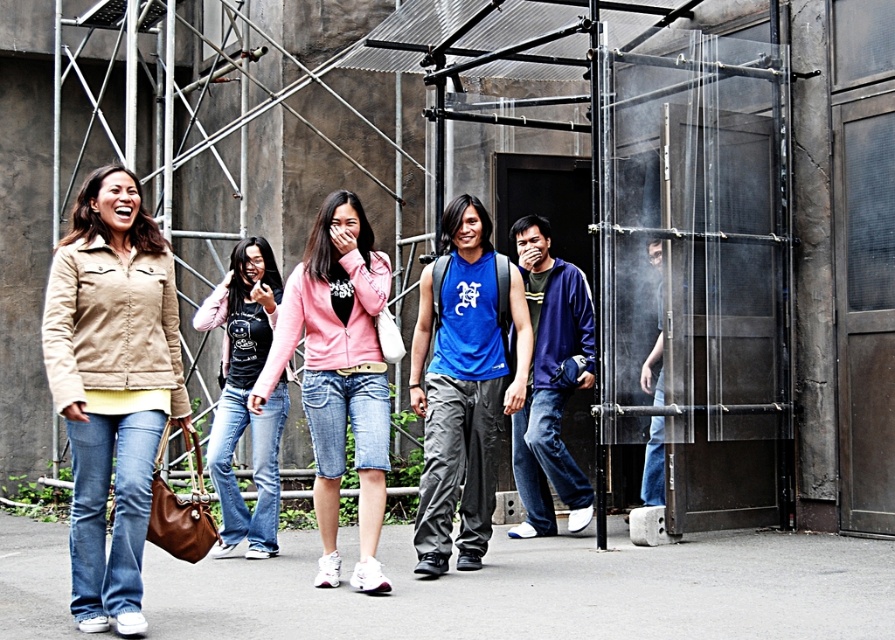
Is beige suede jacket at left in front of dark blue hoodie at center?

Yes, beige suede jacket at left is in front of dark blue hoodie at center.

You are a GUI agent. You are given a task and a screenshot of the screen. Output one action in this format:
    pyautogui.click(x=<x>, y=<y>)
    Task: Click on the beige suede jacket at left
    
    Given the screenshot: What is the action you would take?
    pyautogui.click(x=112, y=385)

Where is `beige suede jacket at left`? beige suede jacket at left is located at coordinates [112, 385].

Can you confirm if beige suede jacket at left is bigger than blue cotton tank top at center?

Indeed, beige suede jacket at left has a larger size compared to blue cotton tank top at center.

Which is above, beige suede jacket at left or blue cotton tank top at center?

beige suede jacket at left

Is point (107, 301) positioned after point (448, 513)?

No, (107, 301) is closer to viewer.

You are a GUI agent. You are given a task and a screenshot of the screen. Output one action in this format:
    pyautogui.click(x=<x>, y=<y>)
    Task: Click on the beige suede jacket at left
    
    Given the screenshot: What is the action you would take?
    pyautogui.click(x=112, y=385)

Does point (437, 516) come in front of point (271, 387)?

That is False.

Between point (425, 276) and point (330, 563), which one is positioned in front?

Point (330, 563)

I want to click on blue cotton tank top at center, so click(463, 387).